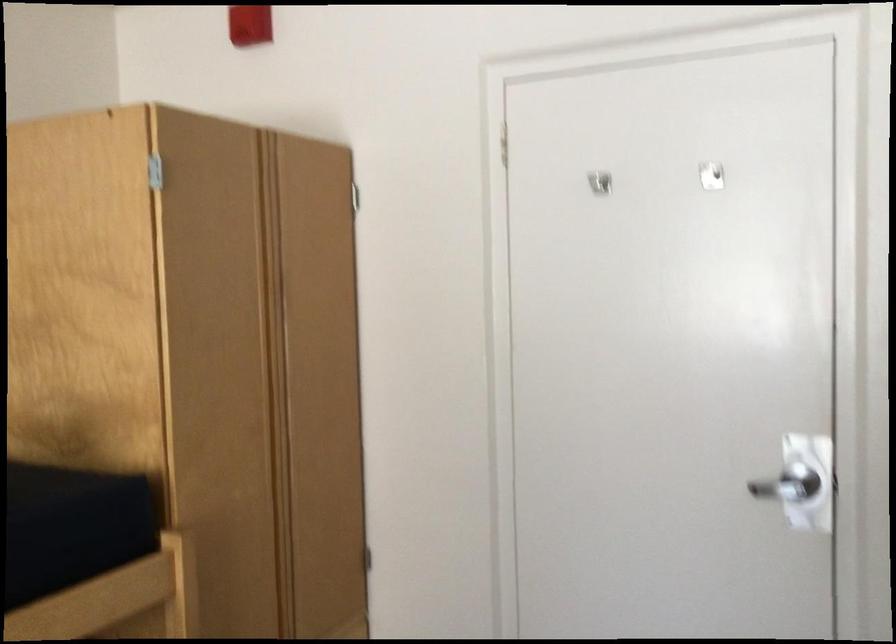
The width and height of the screenshot is (896, 644). Describe the element at coordinates (599, 182) in the screenshot. I see `a metal door hook` at that location.